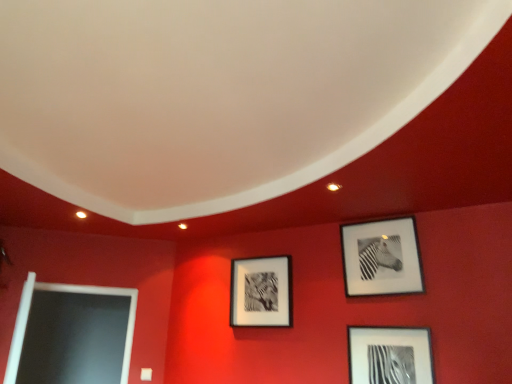
Question: From the image's perspective, is black matte picture frame at upper right, positioned as the first picture frame in right-to-left order, on top of matte black picture frame at center, which is the 3th picture frame from right to left?

Choices:
 (A) yes
 (B) no

Answer: (A)

Question: Is black matte picture frame at upper right, positioned as the first picture frame in right-to-left order, outside of matte black picture frame at center, the first picture frame viewed from the left?

Choices:
 (A) no
 (B) yes

Answer: (B)

Question: Does black matte picture frame at upper right, the 3th picture frame in the left-to-right sequence, have a greater height compared to matte black picture frame at center, which is the 3th picture frame from right to left?

Choices:
 (A) no
 (B) yes

Answer: (B)

Question: Considering the relative sizes of black matte picture frame at upper right, positioned as the first picture frame in right-to-left order, and matte black picture frame at center, the first picture frame viewed from the left, in the image provided, is black matte picture frame at upper right, positioned as the first picture frame in right-to-left order, shorter than matte black picture frame at center, the first picture frame viewed from the left,?

Choices:
 (A) no
 (B) yes

Answer: (A)

Question: Considering the relative sizes of black matte picture frame at upper right, the 3th picture frame in the left-to-right sequence, and matte black picture frame at center, the first picture frame viewed from the left, in the image provided, is black matte picture frame at upper right, the 3th picture frame in the left-to-right sequence, thinner than matte black picture frame at center, the first picture frame viewed from the left,?

Choices:
 (A) yes
 (B) no

Answer: (A)

Question: Does black matte picture frame at upper right, positioned as the first picture frame in right-to-left order, appear on the left side of matte black picture frame at center, the first picture frame viewed from the left?

Choices:
 (A) no
 (B) yes

Answer: (A)

Question: Does metallic silver frame at lower right, which is the second picture frame from right to left, have a larger size compared to matte black picture frame at center, the first picture frame viewed from the left?

Choices:
 (A) no
 (B) yes

Answer: (A)

Question: Is metallic silver frame at lower right, which is the second picture frame from right to left, to the right of matte black picture frame at center, which is the 3th picture frame from right to left, from the viewer's perspective?

Choices:
 (A) no
 (B) yes

Answer: (B)

Question: Can you confirm if metallic silver frame at lower right, which is the 2th picture frame in left-to-right order, is thinner than matte black picture frame at center, which is the 3th picture frame from right to left?

Choices:
 (A) yes
 (B) no

Answer: (A)

Question: Considering the relative sizes of metallic silver frame at lower right, which is the second picture frame from right to left, and matte black picture frame at center, which is the 3th picture frame from right to left, in the image provided, is metallic silver frame at lower right, which is the second picture frame from right to left, taller than matte black picture frame at center, which is the 3th picture frame from right to left,?

Choices:
 (A) no
 (B) yes

Answer: (A)

Question: Does metallic silver frame at lower right, which is the 2th picture frame in left-to-right order, come behind matte black picture frame at center, which is the 3th picture frame from right to left?

Choices:
 (A) no
 (B) yes

Answer: (A)

Question: Is metallic silver frame at lower right, which is the second picture frame from right to left, in front of matte black picture frame at center, which is the 3th picture frame from right to left?

Choices:
 (A) no
 (B) yes

Answer: (B)

Question: Can you confirm if metallic silver frame at lower right, which is the 2th picture frame in left-to-right order, is thinner than black matte picture frame at upper right, positioned as the first picture frame in right-to-left order?

Choices:
 (A) yes
 (B) no

Answer: (B)